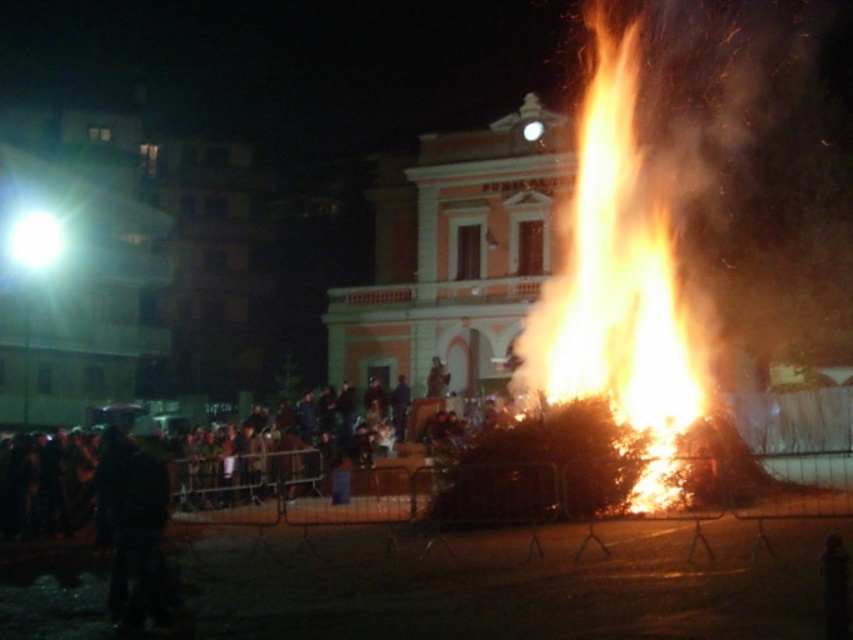
Between flaming wood at center and dark clothing crowd at lower left, which one appears on the right side from the viewer's perspective?

From the viewer's perspective, flaming wood at center appears more on the right side.

The width and height of the screenshot is (853, 640). What do you see at coordinates (624, 276) in the screenshot?
I see `flaming wood at center` at bounding box center [624, 276].

Locate an element on the screen. This screenshot has width=853, height=640. flaming wood at center is located at coordinates (624, 276).